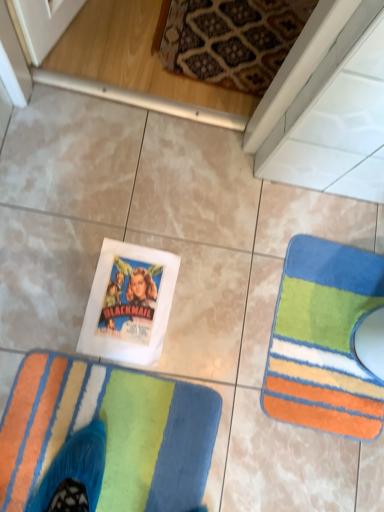
Identify the location of multicolored plush rug at lower right, which appears as the 2th towel when viewed from the front. This screenshot has width=384, height=512. (324, 340).

What is the approximate height of multicolored plush rug at lower right, acting as the 1th towel starting from the right?

The height of multicolored plush rug at lower right, acting as the 1th towel starting from the right, is 0.63 inches.

Describe the element at coordinates (324, 340) in the screenshot. The width and height of the screenshot is (384, 512). I see `multicolored plush rug at lower right, acting as the 1th towel starting from the right` at that location.

Locate an element on the screen. multicolored plush rug at lower left, the second towel viewed from the back is located at coordinates (109, 432).

Describe the element at coordinates (109, 432) in the screenshot. Image resolution: width=384 pixels, height=512 pixels. I see `multicolored plush rug at lower left, the second towel viewed from the back` at that location.

I want to click on multicolored plush rug at lower right, which appears as the 2th towel when viewed from the left, so click(x=324, y=340).

Which object is positioned more to the right, multicolored plush rug at lower left, which is the 2th towel from right to left, or multicolored plush rug at lower right, which appears as the 2th towel when viewed from the front?

Positioned to the right is multicolored plush rug at lower right, which appears as the 2th towel when viewed from the front.

Considering the relative positions of multicolored plush rug at lower left, which ranks as the 1th towel in front-to-back order, and multicolored plush rug at lower right, which appears as the 2th towel when viewed from the left, in the image provided, is multicolored plush rug at lower left, which ranks as the 1th towel in front-to-back order, behind multicolored plush rug at lower right, which appears as the 2th towel when viewed from the left,?

No, multicolored plush rug at lower left, which ranks as the 1th towel in front-to-back order, is closer to the camera.

Considering the points (137, 421) and (348, 417), which point is behind, point (137, 421) or point (348, 417)?

The point (348, 417) is behind.

From the image's perspective, relative to multicolored plush rug at lower right, acting as the 1th towel starting from the right, is multicolored plush rug at lower left, which is the first towel from left to right, above or below?

Based on their image positions, multicolored plush rug at lower left, which is the first towel from left to right, is located beneath multicolored plush rug at lower right, acting as the 1th towel starting from the right.

Consider the image. From a real-world perspective, between multicolored plush rug at lower left, which is the first towel from left to right, and multicolored plush rug at lower right, which appears as the 2th towel when viewed from the left, who is vertically lower?

In real-world perspective, multicolored plush rug at lower right, which appears as the 2th towel when viewed from the left, is lower.

Looking at this image, considering the sizes of objects multicolored plush rug at lower left, the second towel viewed from the back, and multicolored plush rug at lower right, which appears as the 2th towel when viewed from the front, in the image provided, who is thinner, multicolored plush rug at lower left, the second towel viewed from the back, or multicolored plush rug at lower right, which appears as the 2th towel when viewed from the front,?

multicolored plush rug at lower right, which appears as the 2th towel when viewed from the front, is thinner.

Who is shorter, multicolored plush rug at lower left, which is the first towel from left to right, or multicolored plush rug at lower right, which appears as the 2th towel when viewed from the left?

With less height is multicolored plush rug at lower left, which is the first towel from left to right.

Who is smaller, multicolored plush rug at lower left, which is the 2th towel from right to left, or multicolored plush rug at lower right, which appears as the 2th towel when viewed from the front?

With smaller size is multicolored plush rug at lower right, which appears as the 2th towel when viewed from the front.

Is multicolored plush rug at lower left, which is the first towel from left to right, positioned beyond the bounds of multicolored plush rug at lower right, acting as the 1th towel starting from the right?

Indeed, multicolored plush rug at lower left, which is the first towel from left to right, is completely outside multicolored plush rug at lower right, acting as the 1th towel starting from the right.

Looking at this image, are multicolored plush rug at lower left, which is the first towel from left to right, and multicolored plush rug at lower right, which appears as the 2th towel when viewed from the left, located far from each other?

No, multicolored plush rug at lower left, which is the first towel from left to right, is in close proximity to multicolored plush rug at lower right, which appears as the 2th towel when viewed from the left.

Is multicolored plush rug at lower left, which is the 2th towel from right to left, facing towards multicolored plush rug at lower right, acting as the 1th towel starting from the right?

Yes, multicolored plush rug at lower left, which is the 2th towel from right to left, faces towards multicolored plush rug at lower right, acting as the 1th towel starting from the right.

How many degrees apart are the facing directions of multicolored plush rug at lower left, which ranks as the 1th towel in front-to-back order, and multicolored plush rug at lower right, which appears as the 2th towel when viewed from the front?

multicolored plush rug at lower left, which ranks as the 1th towel in front-to-back order, and multicolored plush rug at lower right, which appears as the 2th towel when viewed from the front, are facing 177 degrees away from each other.

Could you measure the distance between multicolored plush rug at lower left, which is the first towel from left to right, and multicolored plush rug at lower right, which appears as the 2th towel when viewed from the front?

They are 14.86 inches apart.

Where is `towel below the multicolored plush rug at lower right, acting as the 1th towel starting from the right (from the image's perspective)`? The height and width of the screenshot is (512, 384). towel below the multicolored plush rug at lower right, acting as the 1th towel starting from the right (from the image's perspective) is located at coordinates (109, 432).

Which is more to the right, multicolored plush rug at lower right, acting as the 1th towel starting from the right, or multicolored plush rug at lower left, which is the 2th towel from right to left?

multicolored plush rug at lower right, acting as the 1th towel starting from the right.

Is multicolored plush rug at lower right, the first towel in the back-to-front sequence, closer to camera compared to multicolored plush rug at lower left, which is the 2th towel from right to left?

No, it is behind multicolored plush rug at lower left, which is the 2th towel from right to left.

Does point (307, 375) lie in front of point (170, 420)?

No, it is behind (170, 420).

From the image's perspective, relative to multicolored plush rug at lower left, which ranks as the 1th towel in front-to-back order, is multicolored plush rug at lower right, which appears as the 2th towel when viewed from the front, above or below?

multicolored plush rug at lower right, which appears as the 2th towel when viewed from the front, is situated higher than multicolored plush rug at lower left, which ranks as the 1th towel in front-to-back order, in the image.

From a real-world perspective, between multicolored plush rug at lower right, the first towel in the back-to-front sequence, and multicolored plush rug at lower left, which ranks as the 1th towel in front-to-back order, who is vertically higher?

multicolored plush rug at lower left, which ranks as the 1th towel in front-to-back order, is physically above.

Is multicolored plush rug at lower right, which appears as the 2th towel when viewed from the left, wider than multicolored plush rug at lower left, the second towel viewed from the back?

In fact, multicolored plush rug at lower right, which appears as the 2th towel when viewed from the left, might be narrower than multicolored plush rug at lower left, the second towel viewed from the back.

Is multicolored plush rug at lower right, acting as the 1th towel starting from the right, shorter than multicolored plush rug at lower left, which ranks as the 1th towel in front-to-back order?

No, multicolored plush rug at lower right, acting as the 1th towel starting from the right, is not shorter than multicolored plush rug at lower left, which ranks as the 1th towel in front-to-back order.

Is multicolored plush rug at lower right, which appears as the 2th towel when viewed from the front, smaller than multicolored plush rug at lower left, which is the 2th towel from right to left?

Yes.

Is multicolored plush rug at lower right, acting as the 1th towel starting from the right, inside the boundaries of multicolored plush rug at lower left, which is the 2th towel from right to left, or outside?

multicolored plush rug at lower right, acting as the 1th towel starting from the right, exists outside the volume of multicolored plush rug at lower left, which is the 2th towel from right to left.

Is multicolored plush rug at lower right, which appears as the 2th towel when viewed from the left, beside multicolored plush rug at lower left, which is the first towel from left to right?

They are not placed beside each other.

Could you tell me if multicolored plush rug at lower right, which appears as the 2th towel when viewed from the left, is turned towards multicolored plush rug at lower left, the second towel viewed from the back?

Yes, multicolored plush rug at lower right, which appears as the 2th towel when viewed from the left, is oriented towards multicolored plush rug at lower left, the second towel viewed from the back.

What's the angular difference between multicolored plush rug at lower right, the first towel in the back-to-front sequence, and multicolored plush rug at lower left, which ranks as the 1th towel in front-to-back order,'s facing directions?

The angle between the facing direction of multicolored plush rug at lower right, the first towel in the back-to-front sequence, and the facing direction of multicolored plush rug at lower left, which ranks as the 1th towel in front-to-back order, is 177 degrees.

The height and width of the screenshot is (512, 384). Identify the location of towel lying below the multicolored plush rug at lower right, which appears as the 2th towel when viewed from the left (from the image's perspective). (109, 432).

Find the location of `towel located underneath the multicolored plush rug at lower left, which is the 2th towel from right to left (from a real-world perspective)`. towel located underneath the multicolored plush rug at lower left, which is the 2th towel from right to left (from a real-world perspective) is located at coordinates (324, 340).

This screenshot has height=512, width=384. I want to click on towel above the multicolored plush rug at lower right, acting as the 1th towel starting from the right (from a real-world perspective), so click(x=109, y=432).